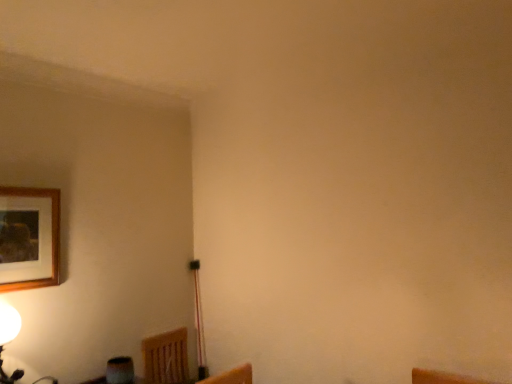
The height and width of the screenshot is (384, 512). What do you see at coordinates (29, 238) in the screenshot?
I see `wooden picture frame at upper left` at bounding box center [29, 238].

You are a GUI agent. You are given a task and a screenshot of the screen. Output one action in this format:
    pyautogui.click(x=<x>, y=<y>)
    Task: Click on the wooden picture frame at upper left
    
    Given the screenshot: What is the action you would take?
    pyautogui.click(x=29, y=238)

You are a GUI agent. You are given a task and a screenshot of the screen. Output one action in this format:
    pyautogui.click(x=<x>, y=<y>)
    Task: Click on the wooden picture frame at upper left
    
    Given the screenshot: What is the action you would take?
    pyautogui.click(x=29, y=238)